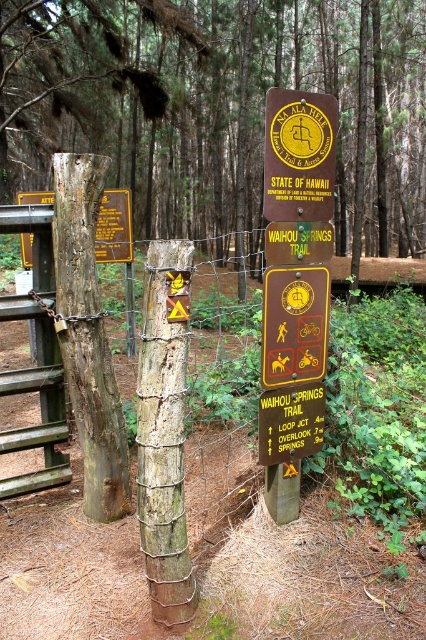
You are standing in a forest and see the brown rough wood at center. Can you determine its exact location based on the coordinates provided?

The brown rough wood at center is located at point (215, 106).